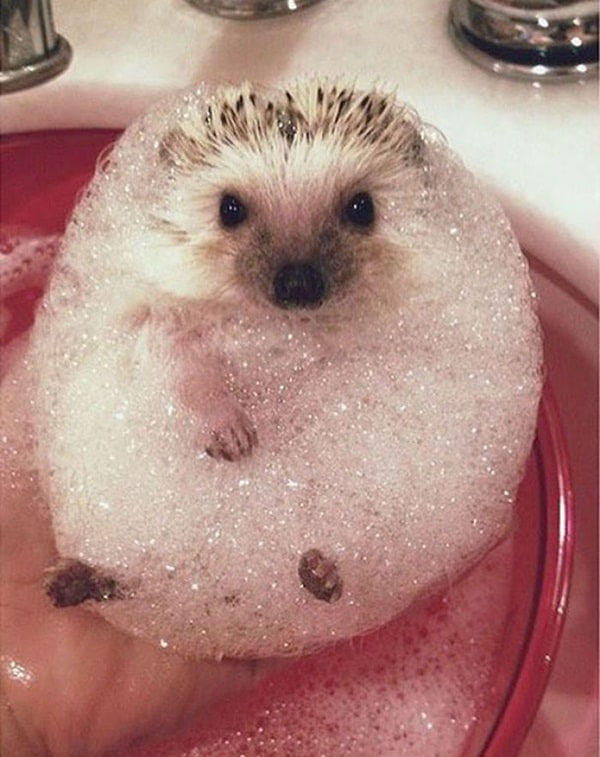
This screenshot has height=757, width=600. I want to click on empty space on countertop, so click(426, 79).